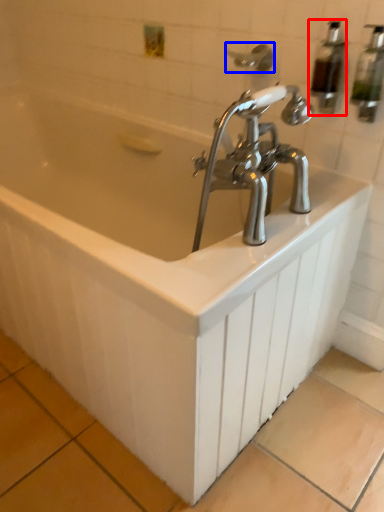
Question: Which object is closer to the camera taking this photo, soap dispenser (highlighted by a red box) or shower (highlighted by a blue box)?

Choices:
 (A) soap dispenser
 (B) shower

Answer: (A)